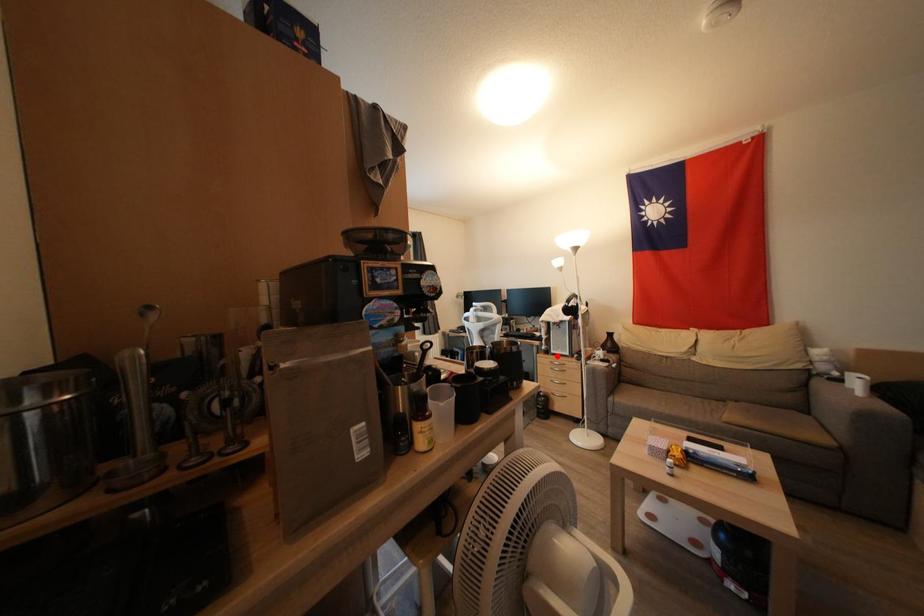
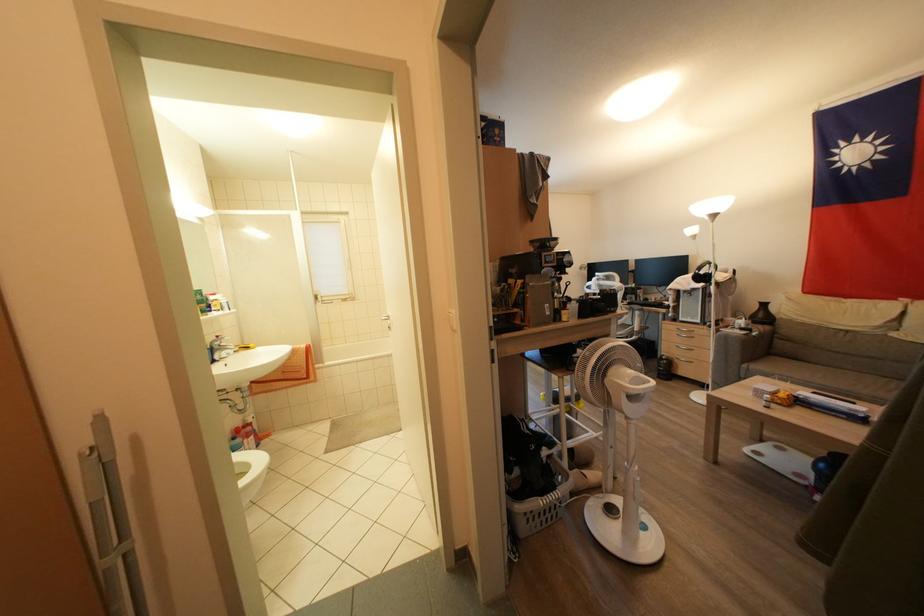
Question: A red point is marked in image1. In image2, is the corresponding 3D point closer to the camera or farther? Reply with the corresponding letter.

Choices:
 (A) The corresponding 3D point is closer.
 (B) The corresponding 3D point is farther.

Answer: (A)